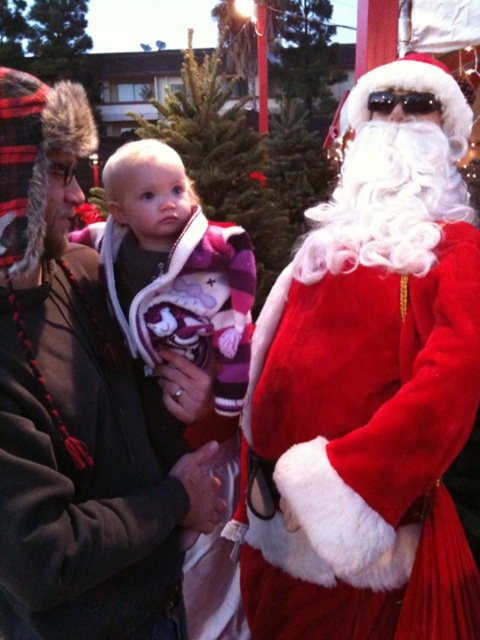
Question: Is velvet red santa claus at right further to camera compared to fuzzy fur hat at upper left?

Choices:
 (A) yes
 (B) no

Answer: (A)

Question: Which of the following is the closest to the observer?

Choices:
 (A) (96, 147)
 (B) (348, 388)

Answer: (A)

Question: Which point is farther from the camera taking this photo?

Choices:
 (A) (57, 220)
 (B) (463, 353)

Answer: (B)

Question: Does velvet red santa claus at right have a smaller size compared to fuzzy fur hat at upper left?

Choices:
 (A) yes
 (B) no

Answer: (B)

Question: Is velvet red santa claus at right smaller than fuzzy fur hat at upper left?

Choices:
 (A) yes
 (B) no

Answer: (B)